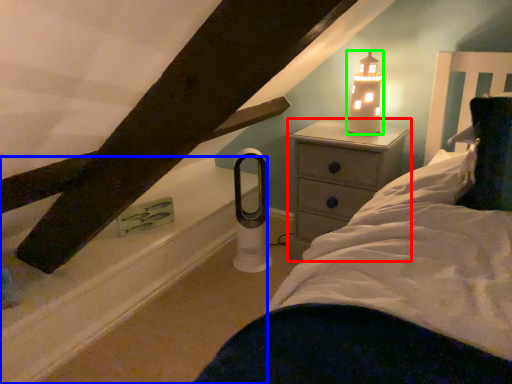
Question: Which is nearer to the nightstand (highlighted by a red box)? window sill (highlighted by a blue box) or candle holder (highlighted by a green box).

Choices:
 (A) window sill
 (B) candle holder

Answer: (B)